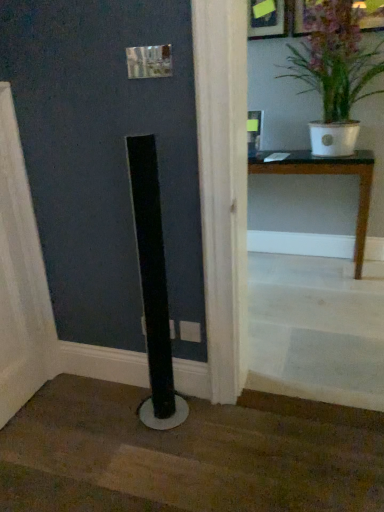
Locate an element on the screen. The height and width of the screenshot is (512, 384). vacant region under wooden table at center (from a real-world perspective) is located at coordinates (295, 265).